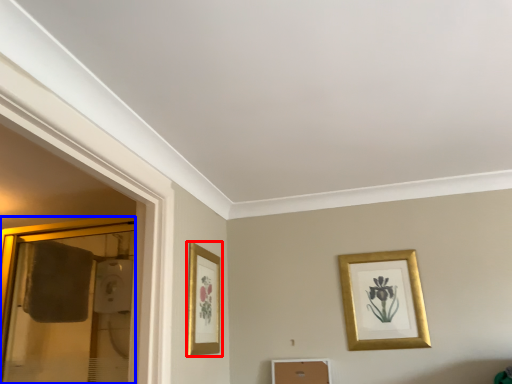
Question: Which of the following is the closest to the observer, picture frame (highlighted by a red box) or glass door (highlighted by a blue box)?

Choices:
 (A) picture frame
 (B) glass door

Answer: (B)